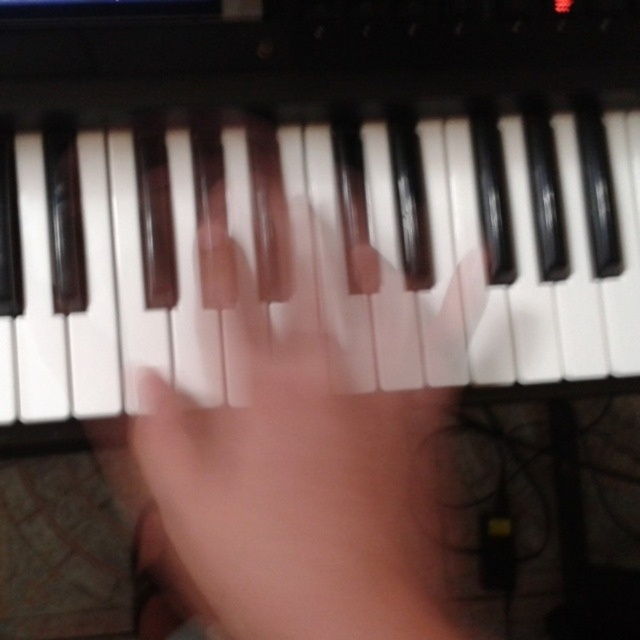
Question: Where is white matte piano keys at center located in relation to satin black hand at center in the image?

Choices:
 (A) left
 (B) right

Answer: (A)

Question: Can you confirm if white matte piano keys at center is smaller than satin black hand at center?

Choices:
 (A) yes
 (B) no

Answer: (A)

Question: From the image, what is the correct spatial relationship of white matte piano keys at center in relation to satin black hand at center?

Choices:
 (A) below
 (B) above

Answer: (B)

Question: Which of the following is the farthest from the observer?

Choices:
 (A) satin black hand at center
 (B) white matte piano keys at center

Answer: (B)